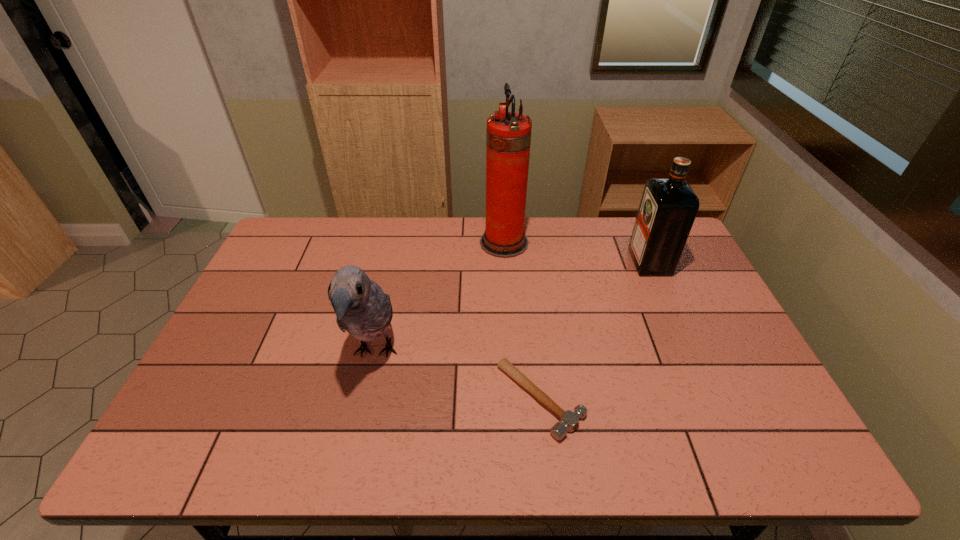
Locate an element on the screen. Image resolution: width=960 pixels, height=540 pixels. free space that satisfies the following two spatial constraints: 1. at the discharge end of the fire extinguisher; 2. on the front-facing side of the leftmost object is located at coordinates (512, 353).

In order to click on free space that satisfies the following two spatial constraints: 1. at the discharge end of the tallest object; 2. on the front-facing side of the parrot in this screenshot , I will do `click(512, 353)`.

This screenshot has height=540, width=960. What are the coordinates of `free region that satisfies the following two spatial constraints: 1. at the discharge end of the fire extinguisher; 2. on the front-facing side of the parrot` in the screenshot? It's located at (512, 353).